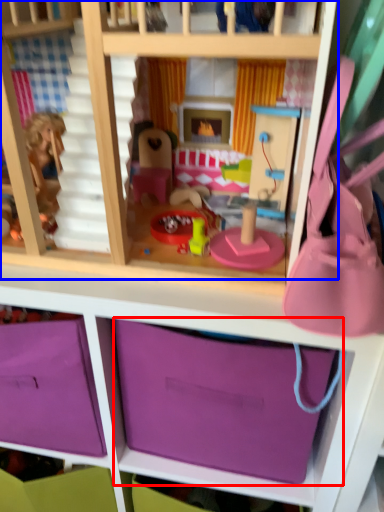
Question: Which object is closer to the camera taking this photo, storage box (highlighted by a red box) or bunk bed (highlighted by a blue box)?

Choices:
 (A) storage box
 (B) bunk bed

Answer: (B)